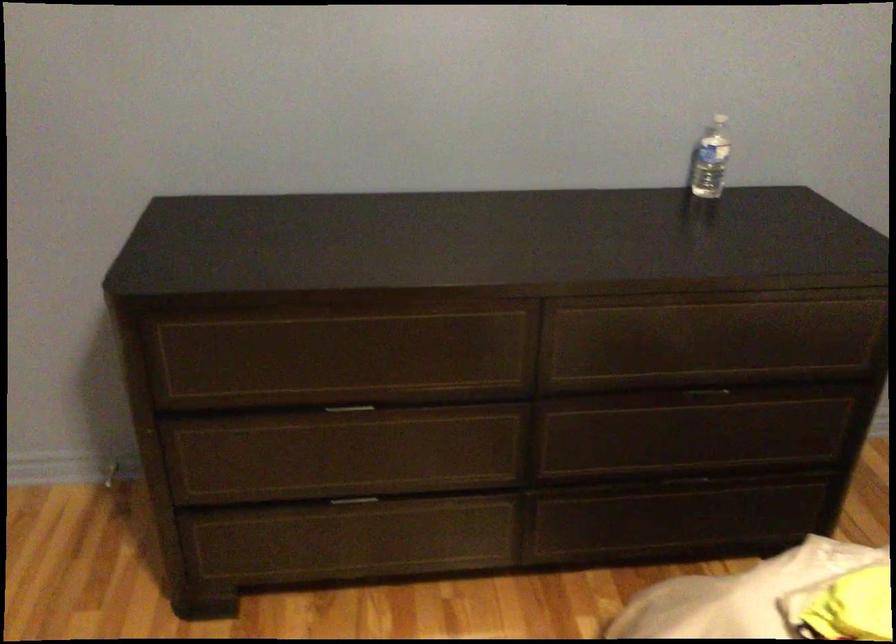
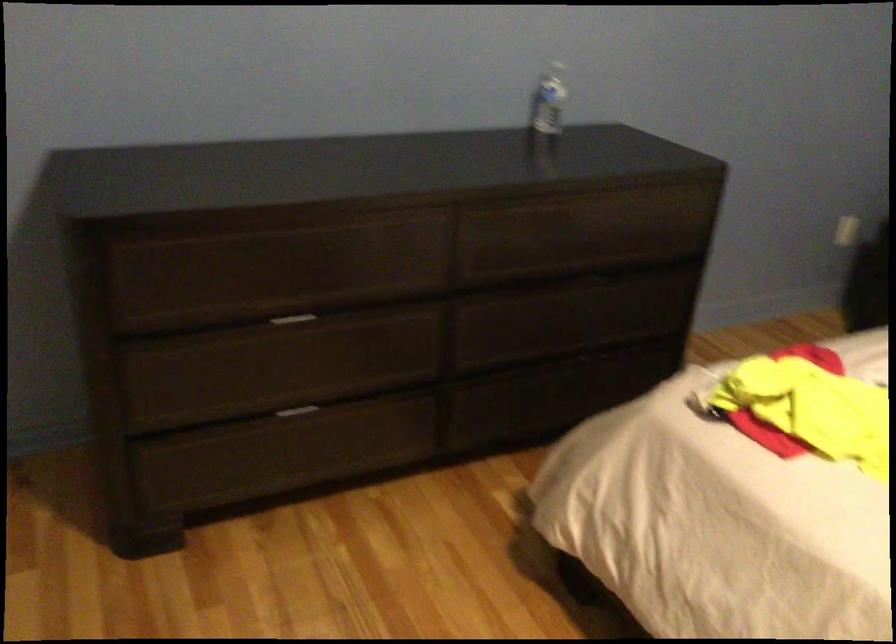
The point at (357, 500) is marked in the first image. Where is the corresponding point in the second image?

(297, 411)